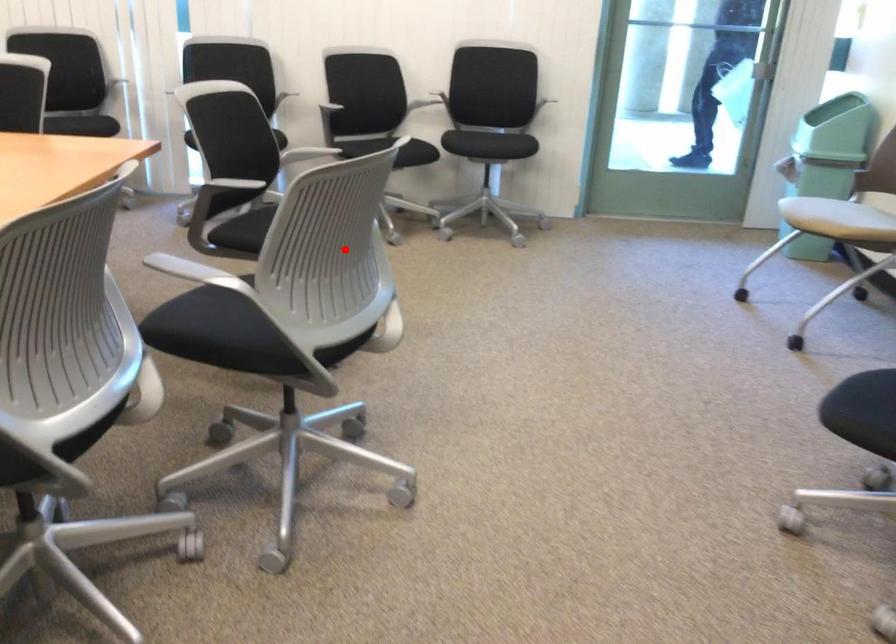
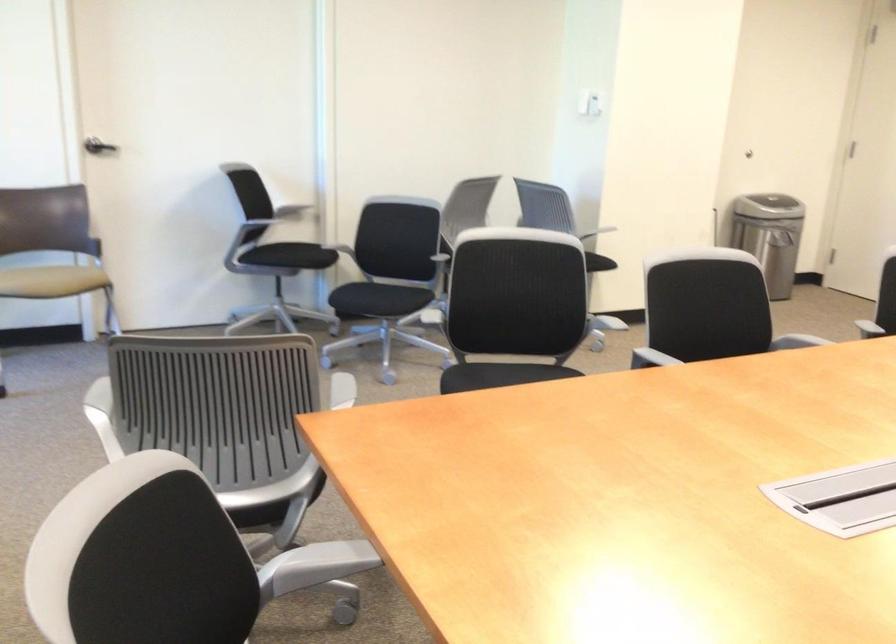
Question: I am providing you with two images of the same scene from different viewpoints. In image1, a red point is highlighted. Considering the same 3D point in image2, which of the following is correct?

Choices:
 (A) It is closer
 (B) It is farther

Answer: (B)